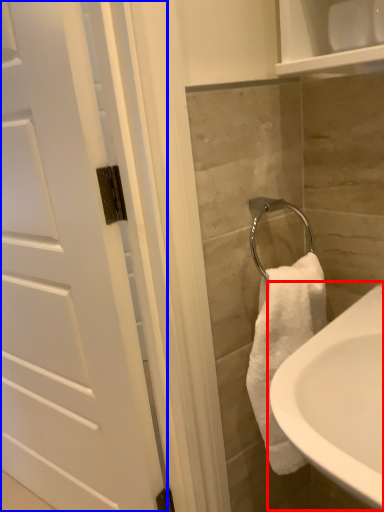
Question: Which of the following is the farthest to the observer, sink (highlighted by a red box) or door (highlighted by a blue box)?

Choices:
 (A) sink
 (B) door

Answer: (B)